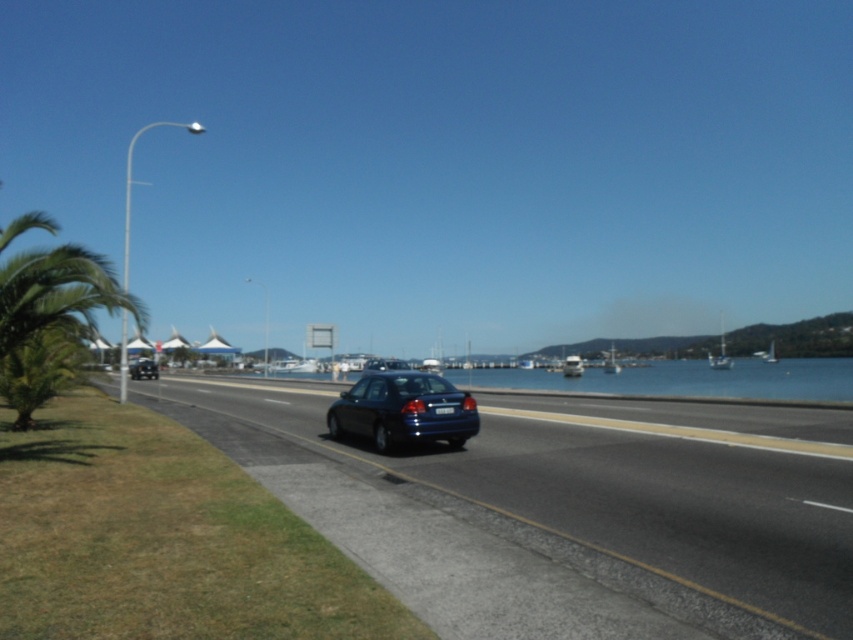
Is glossy blue car at center positioned before black plastic license plate at center?

Yes, it is in front of black plastic license plate at center.

Is point (810, 508) positioned in front of point (439, 408)?

Yes, point (810, 508) is closer to viewer.

Find the location of a particular element. The height and width of the screenshot is (640, 853). glossy blue car at center is located at coordinates (556, 516).

Between point (706, 513) and point (74, 285), which one is positioned in front?

Point (706, 513)

Who is taller, glossy blue car at center or green leafy palm tree at left?

Standing taller between the two is green leafy palm tree at left.

Locate an element on the screen. glossy blue car at center is located at coordinates (556, 516).

Where is `glossy blue car at center`? Image resolution: width=853 pixels, height=640 pixels. glossy blue car at center is located at coordinates (556, 516).

Is green leafy palm tree at left positioned at the back of blue water at center?

No, green leafy palm tree at left is in front of blue water at center.

Which is above, green leafy palm tree at left or blue water at center?

green leafy palm tree at left is higher up.

Is point (15, 307) positioned after point (660, 371)?

No, (15, 307) is in front of (660, 371).

Image resolution: width=853 pixels, height=640 pixels. Identify the location of green leafy palm tree at left. (50, 320).